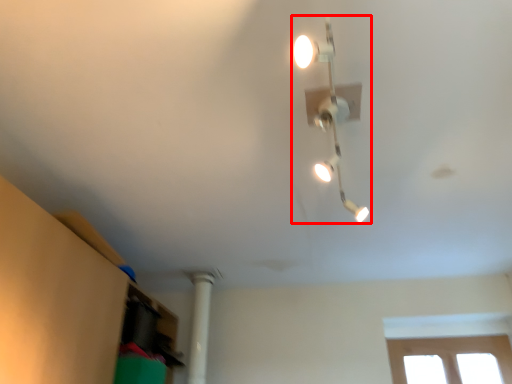
Question: From the image's perspective, where is lamp (annotated by the red box) located in relation to pillar in the image?

Choices:
 (A) above
 (B) below

Answer: (A)